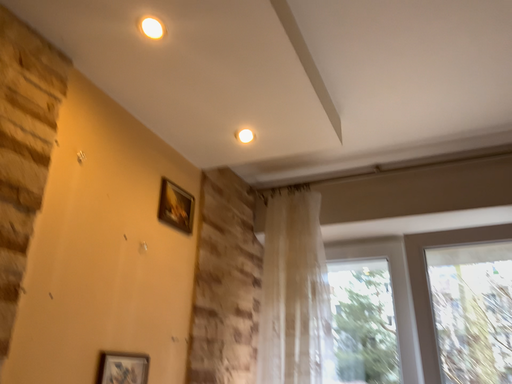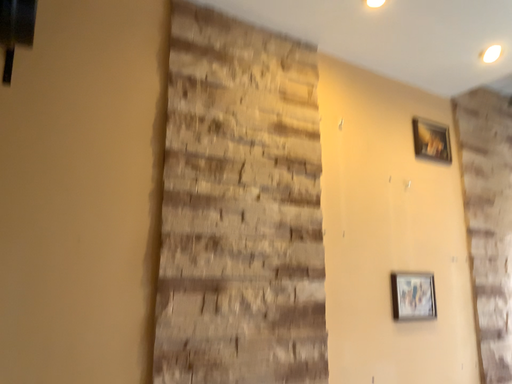
Question: How did the camera likely rotate when shooting the video?

Choices:
 (A) rotated left
 (B) rotated right

Answer: (A)